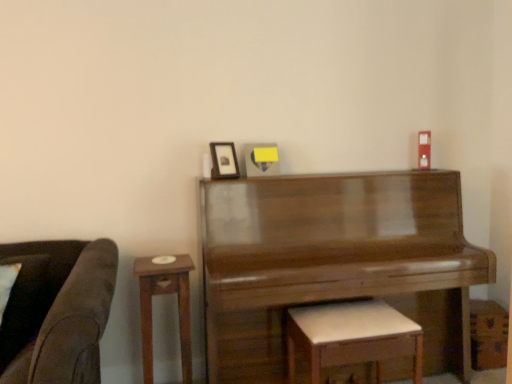
Question: From a real-world perspective, is white leather stool at lower center physically below shiny brown piano at center?

Choices:
 (A) no
 (B) yes

Answer: (B)

Question: Considering the relative positions of white leather stool at lower center and shiny brown piano at center in the image provided, is white leather stool at lower center to the right of shiny brown piano at center from the viewer's perspective?

Choices:
 (A) yes
 (B) no

Answer: (A)

Question: Does white leather stool at lower center appear on the left side of shiny brown piano at center?

Choices:
 (A) no
 (B) yes

Answer: (A)

Question: Can you confirm if white leather stool at lower center is taller than shiny brown piano at center?

Choices:
 (A) no
 (B) yes

Answer: (A)

Question: Is white leather stool at lower center outside shiny brown piano at center?

Choices:
 (A) yes
 (B) no

Answer: (B)

Question: In terms of width, does white leather stool at lower center look wider or thinner when compared to wooden side table at left?

Choices:
 (A) thin
 (B) wide

Answer: (B)

Question: Is white leather stool at lower center taller or shorter than wooden side table at left?

Choices:
 (A) tall
 (B) short

Answer: (B)

Question: Is point (380, 344) closer or farther from the camera than point (165, 284)?

Choices:
 (A) farther
 (B) closer

Answer: (B)

Question: Considering the relative positions of white leather stool at lower center and wooden side table at left in the image provided, is white leather stool at lower center to the left or to the right of wooden side table at left?

Choices:
 (A) right
 (B) left

Answer: (A)

Question: Relative to shiny brown piano at center, is matte black picture frame at upper center in front or behind?

Choices:
 (A) behind
 (B) front

Answer: (A)

Question: Considering the positions of matte black picture frame at upper center and shiny brown piano at center in the image, is matte black picture frame at upper center taller or shorter than shiny brown piano at center?

Choices:
 (A) short
 (B) tall

Answer: (A)

Question: Considering the positions of point (221, 165) and point (218, 337), is point (221, 165) closer or farther from the camera than point (218, 337)?

Choices:
 (A) farther
 (B) closer

Answer: (A)

Question: From a real-world perspective, is matte black picture frame at upper center physically located above or below shiny brown piano at center?

Choices:
 (A) below
 (B) above

Answer: (B)

Question: From a real-world perspective, relative to matte black picture frame at upper center, is wooden side table at left vertically above or below?

Choices:
 (A) above
 (B) below

Answer: (B)

Question: Is point (181, 302) closer or farther from the camera than point (222, 172)?

Choices:
 (A) farther
 (B) closer

Answer: (B)